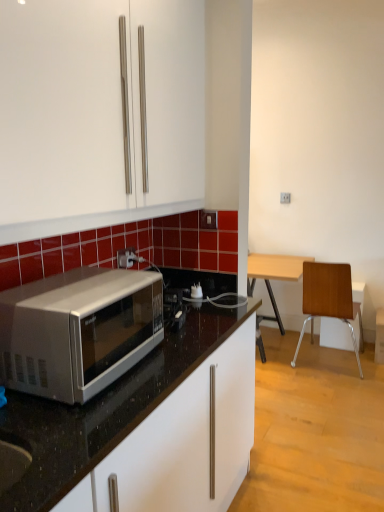
Image resolution: width=384 pixels, height=512 pixels. What do you see at coordinates (329, 298) in the screenshot?
I see `wooden/metallic chair at right` at bounding box center [329, 298].

Describe the element at coordinates (78, 331) in the screenshot. I see `silver metallic microwave at left` at that location.

The height and width of the screenshot is (512, 384). I want to click on silver metallic microwave at left, so click(183, 442).

Is white plastic power outlet at center at the back of silver metallic microwave at left?

That's not correct — silver metallic microwave at left is not looking away from white plastic power outlet at center.

Is the position of silver metallic microwave at left less distant than that of white plastic power outlet at center?

That is True.

Considering the relative sizes of silver metallic microwave at left and white plastic power outlet at center in the image provided, is silver metallic microwave at left wider than white plastic power outlet at center?

Yes, silver metallic microwave at left is wider than white plastic power outlet at center.

Does point (217, 459) come in front of point (117, 265)?

That is True.

From the image's perspective, who appears lower, silver metallic microwave at left or silver metallic microwave at left?

silver metallic microwave at left, from the image's perspective.

Is silver metallic microwave at left far from silver metallic microwave at left?

No.

In terms of height, does silver metallic microwave at left look taller or shorter compared to silver metallic microwave at left?

In the image, silver metallic microwave at left appears to be taller than silver metallic microwave at left.

This screenshot has width=384, height=512. Find the location of `microwave oven above the silver metallic microwave at left (from a real-world perspective)`. microwave oven above the silver metallic microwave at left (from a real-world perspective) is located at coordinates tap(78, 331).

Measure the distance between silver metallic microwave at left and white plastic power outlet at center.

silver metallic microwave at left is 27.39 inches away from white plastic power outlet at center.

Could you tell me if silver metallic microwave at left is facing white plastic power outlet at center?

No, silver metallic microwave at left is not turned towards white plastic power outlet at center.

Who is shorter, silver metallic microwave at left or white plastic power outlet at center?

With less height is white plastic power outlet at center.

I want to click on power outlet that is above the silver metallic microwave at left (from the image's perspective), so click(x=126, y=258).

From the image's perspective, does wooden/metallic chair at right appear higher than silver metallic microwave at left?

No.

Which object is wider, wooden/metallic chair at right or silver metallic microwave at left?

With larger width is wooden/metallic chair at right.

Is wooden/metallic chair at right located outside silver metallic microwave at left?

Yes, wooden/metallic chair at right is outside of silver metallic microwave at left.

Considering the sizes of objects wooden/metallic chair at right and silver metallic microwave at left in the image provided, who is shorter, wooden/metallic chair at right or silver metallic microwave at left?

silver metallic microwave at left.

In the scene shown: Who is more distant, wooden/metallic chair at right or white plastic power outlet at center?

wooden/metallic chair at right is further from the camera.

From a real-world perspective, is wooden/metallic chair at right positioned over white plastic power outlet at center based on gravity?

No, from a real-world perspective, wooden/metallic chair at right is not on top of white plastic power outlet at center.

Who is smaller, wooden/metallic chair at right or white plastic power outlet at center?

white plastic power outlet at center is smaller.

What are the coordinates of `chair that is above the silver metallic microwave at left (from the image's perspective)` in the screenshot? It's located at (329, 298).

From a real-world perspective, is silver metallic microwave at left above or below wooden/metallic chair at right?

From a real-world perspective, silver metallic microwave at left is physically above wooden/metallic chair at right.

Is point (206, 401) closer or farther from the camera than point (317, 300)?

Point (206, 401) appears to be closer to the viewer than point (317, 300).

Is silver metallic microwave at left not close to wooden/metallic chair at right?

silver metallic microwave at left is far away from wooden/metallic chair at right.

Which is correct: silver metallic microwave at left is inside silver metallic microwave at left, or outside of it?

silver metallic microwave at left can be found inside silver metallic microwave at left.

Is silver metallic microwave at left facing towards silver metallic microwave at left?

No, silver metallic microwave at left does not turn towards silver metallic microwave at left.

At what (x,y) coordinates should I click in order to perform the action: click on power outlet above the silver metallic microwave at left (from the image's perspective). Please return your answer as a coordinate pair (x, y). The image size is (384, 512). Looking at the image, I should click on (126, 258).

Locate an element on the screen. The height and width of the screenshot is (512, 384). microwave oven that appears on the left of silver metallic microwave at left is located at coordinates (78, 331).

Estimate the real-world distances between objects in this image. Which object is further from white plastic power outlet at center, silver metallic microwave at left or silver metallic microwave at left?

Among the two, silver metallic microwave at left is located further to white plastic power outlet at center.

Based on their spatial positions, is silver metallic microwave at left or white plastic power outlet at center further from wooden/metallic chair at right?

white plastic power outlet at center is further to wooden/metallic chair at right.

Estimate the real-world distances between objects in this image. Which object is closer to silver metallic microwave at left, wooden/metallic chair at right or silver metallic microwave at left?

silver metallic microwave at left lies closer to silver metallic microwave at left than the other object.

When comparing their distances from wooden/metallic chair at right, does silver metallic microwave at left or silver metallic microwave at left seem further?

Based on the image, silver metallic microwave at left appears to be further to wooden/metallic chair at right.

Looking at the image, which one is located closer to wooden/metallic chair at right, white plastic power outlet at center or silver metallic microwave at left?

Based on the image, silver metallic microwave at left appears to be nearer to wooden/metallic chair at right.

Which object lies nearer to the anchor point silver metallic microwave at left, silver metallic microwave at left or wooden/metallic chair at right?

silver metallic microwave at left is closer to silver metallic microwave at left.

From the image, which object appears to be nearer to silver metallic microwave at left, white plastic power outlet at center or wooden/metallic chair at right?

white plastic power outlet at center is closer to silver metallic microwave at left.

Considering their positions, is silver metallic microwave at left positioned closer to wooden/metallic chair at right than silver metallic microwave at left?

silver metallic microwave at left is closer to wooden/metallic chair at right.

Where is `power outlet between silver metallic microwave at left and wooden/metallic chair at right from front to back`? power outlet between silver metallic microwave at left and wooden/metallic chair at right from front to back is located at coordinates click(x=126, y=258).

Locate an element on the screen. cabinetry between silver metallic microwave at left and white plastic power outlet at center from front to back is located at coordinates (183, 442).

Where is `cabinetry positioned between silver metallic microwave at left and wooden/metallic chair at right from near to far`? This screenshot has width=384, height=512. cabinetry positioned between silver metallic microwave at left and wooden/metallic chair at right from near to far is located at coordinates (183, 442).

I want to click on power outlet positioned between silver metallic microwave at left and wooden/metallic chair at right from near to far, so click(x=126, y=258).